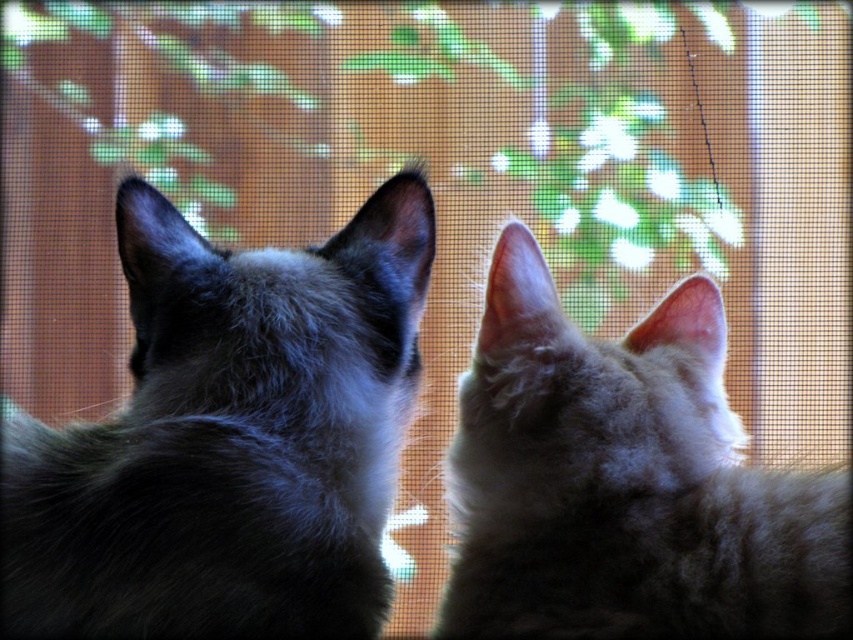
Question: Does silky black cat at left have a lesser width compared to fuzzy gray cat at center?

Choices:
 (A) no
 (B) yes

Answer: (A)

Question: Does silky black cat at left come behind fuzzy gray cat at center?

Choices:
 (A) yes
 (B) no

Answer: (A)

Question: Observing the image, what is the correct spatial positioning of silky black cat at left in reference to fuzzy gray cat at center?

Choices:
 (A) right
 (B) left

Answer: (B)